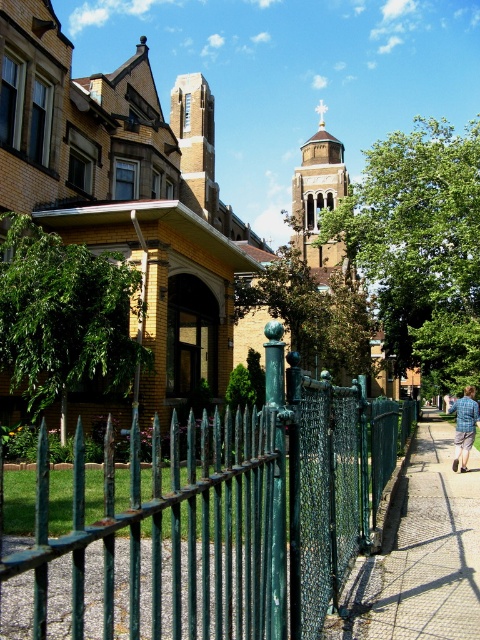
Can you confirm if green metal fence at center is positioned above blue plaid shirt at right?

Correct, green metal fence at center is located above blue plaid shirt at right.

Describe the element at coordinates (231, 512) in the screenshot. I see `green metal fence at center` at that location.

The image size is (480, 640). What are the coordinates of `green metal fence at center` in the screenshot? It's located at (231, 512).

Is smooth concrete sidewalk at lower right wider than blue plaid shirt at right?

No.

Does smooth concrete sidewalk at lower right lie behind blue plaid shirt at right?

No.

Does point (368, 605) come behind point (475, 406)?

No, (368, 605) is closer to viewer.

Image resolution: width=480 pixels, height=640 pixels. I want to click on smooth concrete sidewalk at lower right, so click(422, 552).

Consider the image. Between green metal fence at center and smooth concrete sidewalk at lower right, which one appears on the right side from the viewer's perspective?

smooth concrete sidewalk at lower right is more to the right.

Is green metal fence at center positioned in front of smooth concrete sidewalk at lower right?

Yes, it is in front of smooth concrete sidewalk at lower right.

Is point (303, 563) in front of point (436, 561)?

That is True.

Where is `green metal fence at center`? green metal fence at center is located at coordinates (231, 512).